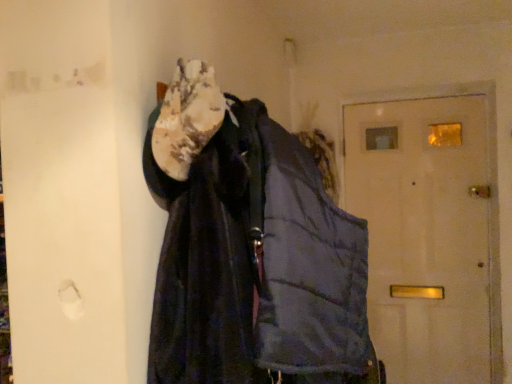
Question: Is dark blue quilted jacket at center thinner than white fuzzy scarf at upper center?

Choices:
 (A) no
 (B) yes

Answer: (A)

Question: From a real-world perspective, is dark blue quilted jacket at center physically below white fuzzy scarf at upper center?

Choices:
 (A) no
 (B) yes

Answer: (B)

Question: Would you say white fuzzy scarf at upper center is part of dark blue quilted jacket at center's contents?

Choices:
 (A) no
 (B) yes

Answer: (B)

Question: Considering the relative positions of dark blue quilted jacket at center and white fuzzy scarf at upper center in the image provided, is dark blue quilted jacket at center in front of white fuzzy scarf at upper center?

Choices:
 (A) no
 (B) yes

Answer: (B)

Question: Does dark blue quilted jacket at center have a greater height compared to white fuzzy scarf at upper center?

Choices:
 (A) no
 (B) yes

Answer: (B)

Question: Is dark blue quilted jacket at center outside white fuzzy scarf at upper center?

Choices:
 (A) no
 (B) yes

Answer: (B)

Question: Is the surface of white fuzzy scarf at upper center in direct contact with white matte door at center?

Choices:
 (A) yes
 (B) no

Answer: (B)

Question: Is white fuzzy scarf at upper center positioned before white matte door at center?

Choices:
 (A) no
 (B) yes

Answer: (B)

Question: Can you confirm if white fuzzy scarf at upper center is shorter than white matte door at center?

Choices:
 (A) yes
 (B) no

Answer: (A)

Question: Considering the relative sizes of white fuzzy scarf at upper center and white matte door at center in the image provided, is white fuzzy scarf at upper center thinner than white matte door at center?

Choices:
 (A) yes
 (B) no

Answer: (A)

Question: Considering the relative positions of white fuzzy scarf at upper center and white matte door at center in the image provided, is white fuzzy scarf at upper center to the right of white matte door at center from the viewer's perspective?

Choices:
 (A) yes
 (B) no

Answer: (B)

Question: From the image's perspective, is white fuzzy scarf at upper center over white matte door at center?

Choices:
 (A) no
 (B) yes

Answer: (B)

Question: From the image's perspective, would you say dark blue quilted jacket at center is shown under white matte door at center?

Choices:
 (A) no
 (B) yes

Answer: (A)